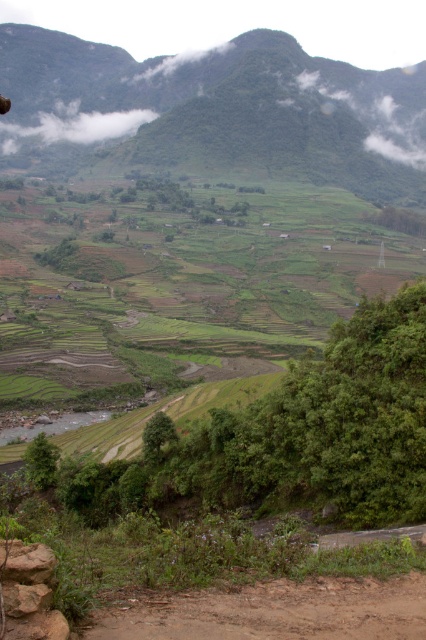
Can you confirm if green grassy mountain at upper center is smaller than brown dirt track at lower center?

No, green grassy mountain at upper center is not smaller than brown dirt track at lower center.

The height and width of the screenshot is (640, 426). I want to click on green grassy mountain at upper center, so click(x=221, y=109).